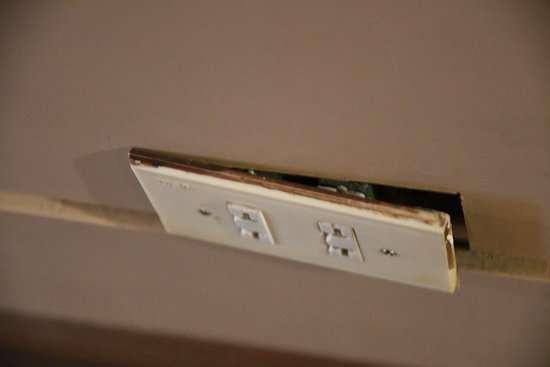
You are a GUI agent. You are given a task and a screenshot of the screen. Output one action in this format:
    pyautogui.click(x=<x>, y=<y>)
    Task: Click on the hole in wall
    
    Given the screenshot: What is the action you would take?
    pyautogui.click(x=417, y=203)